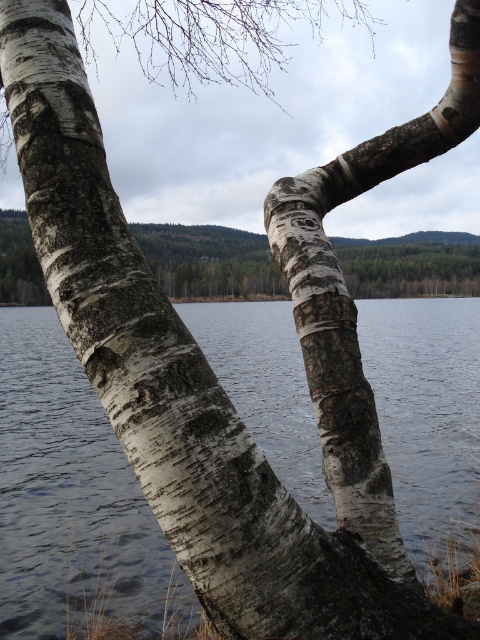
Question: Is white bark tree trunk at center thinner than white bark tree at center?

Choices:
 (A) yes
 (B) no

Answer: (A)

Question: Which object appears farthest from the camera in this image?

Choices:
 (A) white bark tree at center
 (B) white bark tree trunk at center

Answer: (A)

Question: Can you confirm if white bark tree trunk at center is wider than white bark tree at center?

Choices:
 (A) no
 (B) yes

Answer: (A)

Question: In this image, where is white bark tree trunk at center located relative to white bark tree at center?

Choices:
 (A) below
 (B) above

Answer: (A)

Question: Among these objects, which one is farthest from the camera?

Choices:
 (A) white bark tree at center
 (B) white bark tree trunk at center

Answer: (A)

Question: Which point is closer to the camera?

Choices:
 (A) (314, 301)
 (B) (9, 276)

Answer: (A)